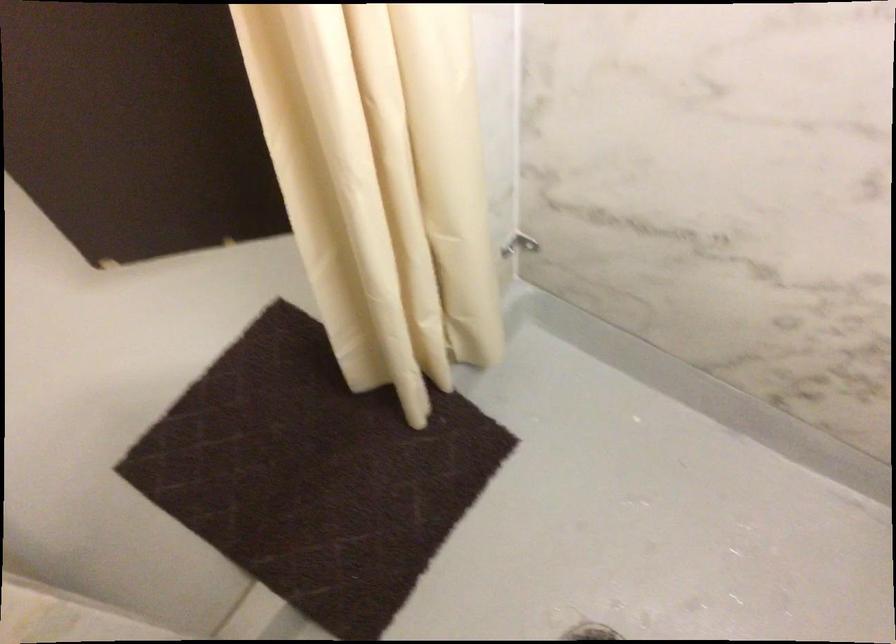
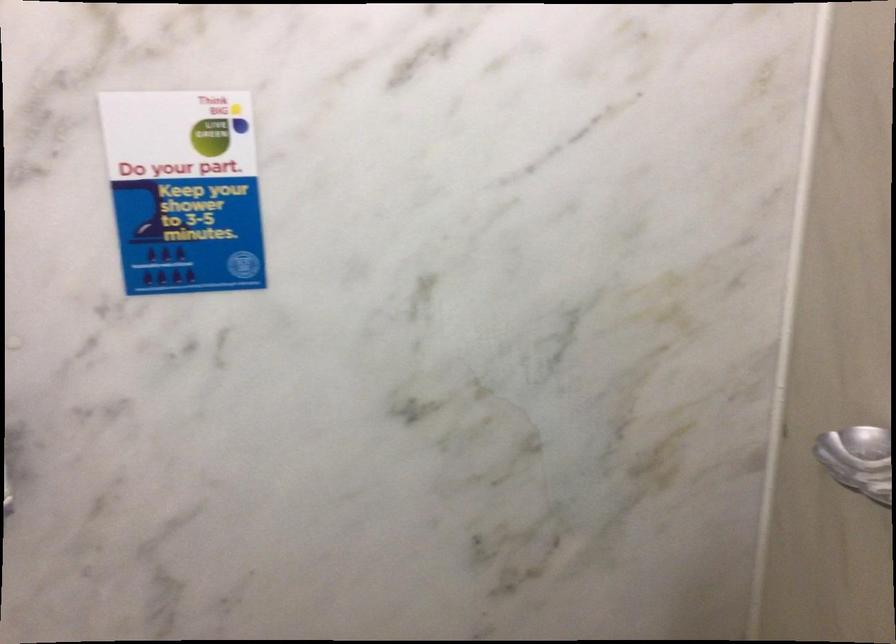
In the scene shown: First-person continuous shooting, in which direction is the camera rotating?

The rotation direction of the camera is right-down.